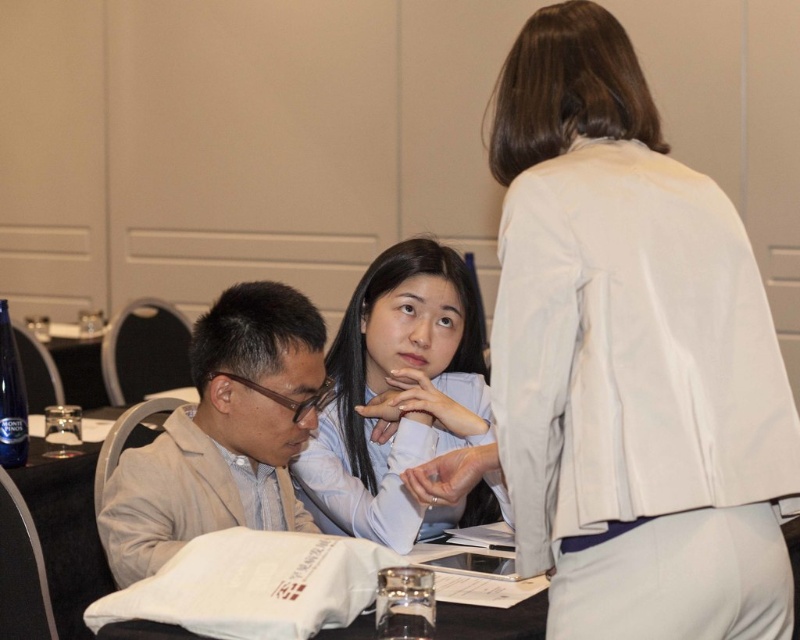
Does beige fabric suit at left lie behind white paper bag at lower center?

Yes, beige fabric suit at left is behind white paper bag at lower center.

Is beige fabric suit at left below white paper bag at lower center?

No.

Who is more forward, (222, 374) or (244, 637)?

Point (244, 637)

Identify the location of beige fabric suit at left. (224, 433).

Is point (638, 554) closer to viewer compared to point (342, 531)?

Yes, point (638, 554) is in front of point (342, 531).

Does white fabric jacket at upper right have a lesser height compared to light blue shirt at center?

No.

This screenshot has width=800, height=640. I want to click on white fabric jacket at upper right, so click(632, 358).

Where is `white fabric jacket at upper right`? white fabric jacket at upper right is located at coordinates (632, 358).

Is point (433, 300) more distant than point (244, 618)?

Yes, it is behind point (244, 618).

Is light blue shirt at center in front of white paper bag at lower center?

No, light blue shirt at center is behind white paper bag at lower center.

Who is more distant from viewer, (424, 436) or (344, 557)?

The point (424, 436) is more distant.

This screenshot has width=800, height=640. In order to click on light blue shirt at center in this screenshot , I will do (x=402, y=401).